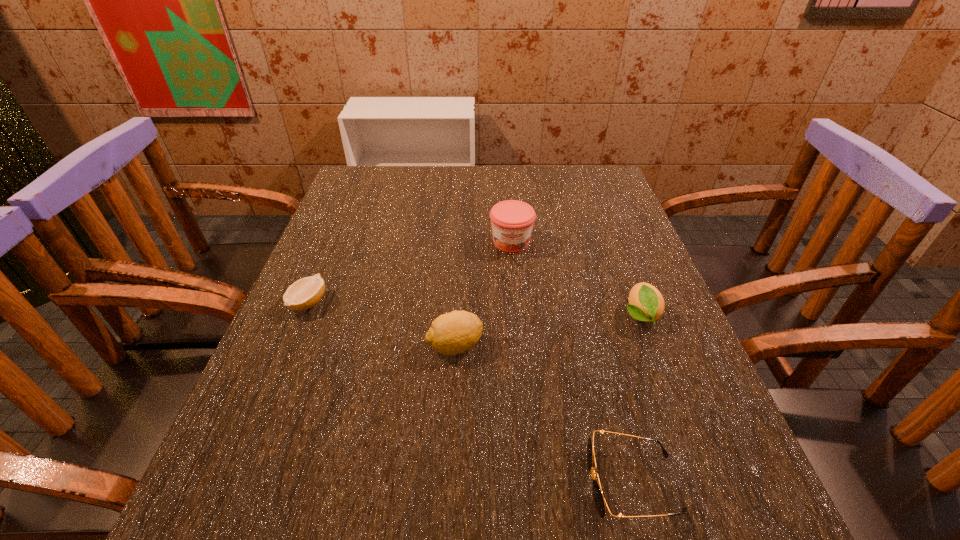
Image resolution: width=960 pixels, height=540 pixels. What are the coordinates of `the tallest object` in the screenshot? It's located at (512, 221).

Identify the location of jam. The width and height of the screenshot is (960, 540). click(x=512, y=221).

This screenshot has height=540, width=960. I want to click on the fourth object from right to left, so click(x=452, y=333).

You are a GUI agent. You are given a task and a screenshot of the screen. Output one action in this format:
    pyautogui.click(x=<x>, y=<y>)
    Task: Click on the rightmost lemon
    The height and width of the screenshot is (540, 960).
    Given the screenshot: What is the action you would take?
    coord(646,303)

Where is `the shortest lemon`? This screenshot has height=540, width=960. the shortest lemon is located at coordinates (305, 293).

Locate an element on the screen. This screenshot has height=540, width=960. the leftmost lemon is located at coordinates (305, 293).

Identify the location of the nearest object. This screenshot has width=960, height=540. (599, 499).

Where is `the second object from right to left`? The height and width of the screenshot is (540, 960). the second object from right to left is located at coordinates (599, 499).

You are a GUI agent. You are given a task and a screenshot of the screen. Output one action in this format:
    pyautogui.click(x=<x>, y=<y>)
    Task: Click on the blank area located on the front label of the tallest object
    This screenshot has width=960, height=540.
    Given the screenshot: What is the action you would take?
    click(514, 272)

Image resolution: width=960 pixels, height=540 pixels. Identify the location of free spot located 0.090m at the stem end of the second lemon from left to right. click(x=529, y=346).